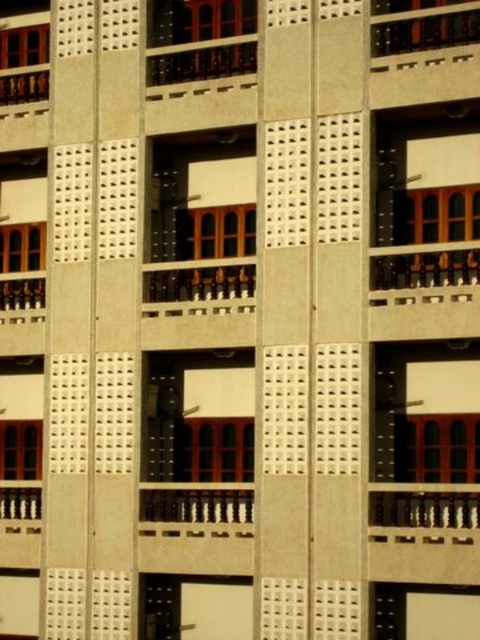
You are standing in front of the building and want to locate the wooden railing at left. According to the coordinates provided, where should you look on the image?

The wooden railing at left is located at point (22, 300) on the image.

You are standing in front of the building and notice a specific point marked at coordinates point (22, 300). Based on the wooden railing at left, can you determine if this point is located on the wooden railing at left?

The wooden railing at left is represented by point (22, 300), so yes, the point is located on the wooden railing at left.